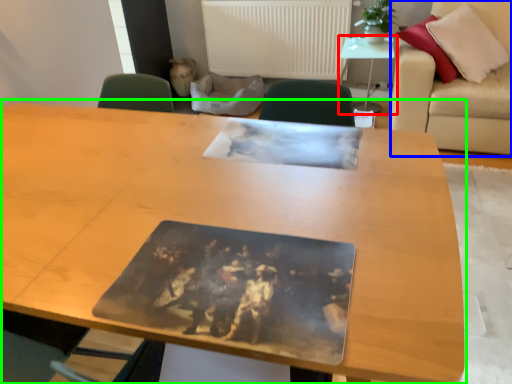
Question: Which object is the closest to the table (highlighted by a red box)? Choose among these: couch (highlighted by a blue box) or table (highlighted by a green box).

Choices:
 (A) couch
 (B) table

Answer: (A)